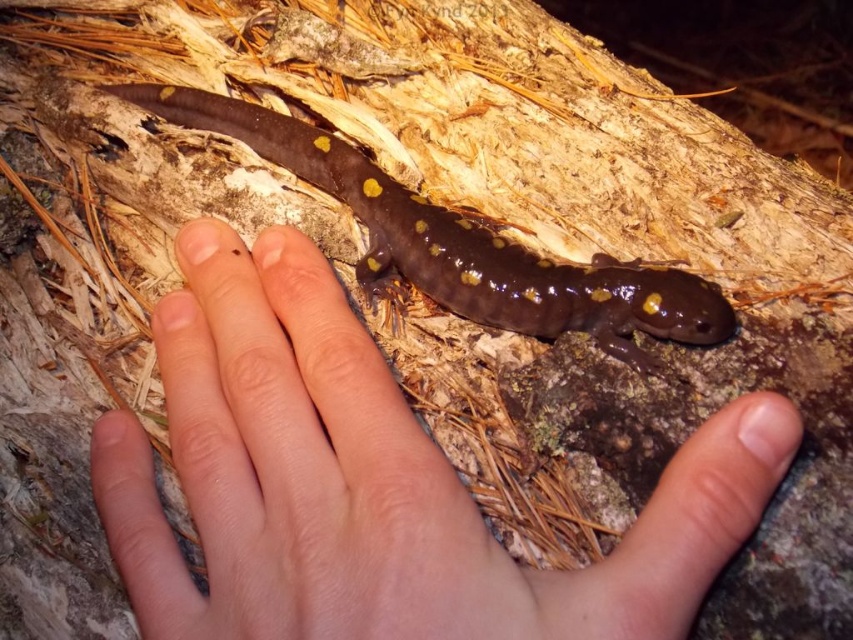
Question: Which point is farther to the camera?

Choices:
 (A) (480, 310)
 (B) (358, 458)

Answer: (A)

Question: Which point is farther from the camera taking this photo?

Choices:
 (A) (601, 340)
 (B) (480, 627)

Answer: (A)

Question: From the image, what is the correct spatial relationship of smooth skin hand at center in relation to shiny brown salamander at center?

Choices:
 (A) below
 (B) above

Answer: (A)

Question: Which point is farther to the camera?

Choices:
 (A) (155, 579)
 (B) (384, 276)

Answer: (B)

Question: Is smooth skin hand at center closer to the viewer compared to shiny brown salamander at center?

Choices:
 (A) yes
 (B) no

Answer: (A)

Question: In this image, where is smooth skin hand at center located relative to shiny brown salamander at center?

Choices:
 (A) left
 (B) right

Answer: (B)